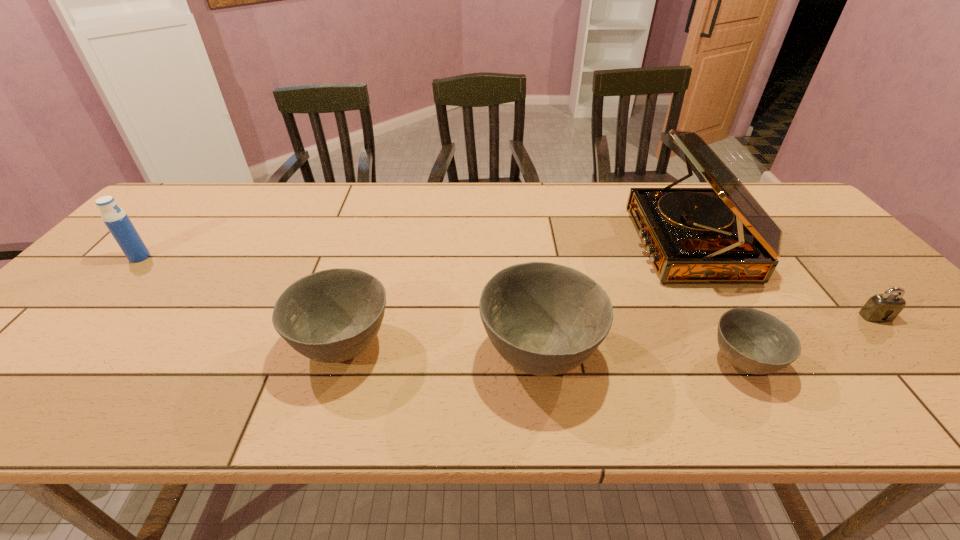
In the image, there is a desktop. What are the coordinates of `vacant region at the near edge` in the screenshot? It's located at coord(645,362).

I want to click on vacant space at the left edge of the desktop, so pyautogui.click(x=78, y=313).

You are a GUI agent. You are given a task and a screenshot of the screen. Output one action in this format:
    pyautogui.click(x=<x>, y=<y>)
    Task: Click on the free space at the right edge of the desktop
    
    Given the screenshot: What is the action you would take?
    pyautogui.click(x=788, y=237)

Locate an element on the screen. The height and width of the screenshot is (540, 960). vacant space at the far left corner of the desktop is located at coordinates (197, 195).

Identify the location of free point between the shortest bowl and the tallest object. (716, 302).

At what (x,y) coordinates should I click in order to perform the action: click on free space between the tallest object and the third object from left to right. Please return your answer as a coordinate pair (x, y). Looking at the image, I should click on (614, 298).

Locate an element on the screen. free spot between the second bowl from right to left and the second object from left to right is located at coordinates (441, 349).

Identify the location of unoccupied position between the rightmost bowl and the third object from left to right. This screenshot has height=540, width=960. (641, 357).

Locate an element on the screen. Image resolution: width=960 pixels, height=540 pixels. free point between the second bowl from right to left and the rightmost bowl is located at coordinates (641, 357).

Locate an element on the screen. The width and height of the screenshot is (960, 540). empty location between the third object from left to right and the second object from left to right is located at coordinates (441, 349).